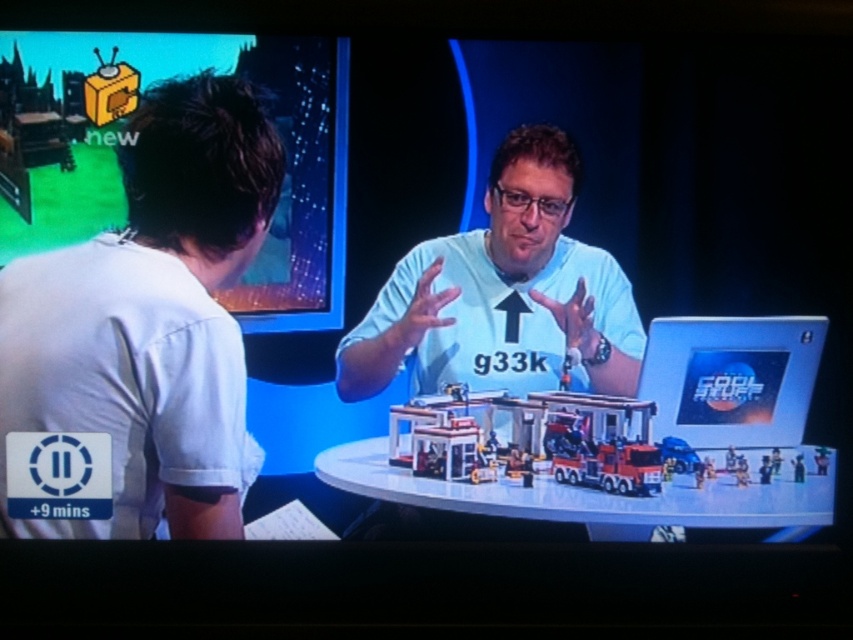
Between point (218, 221) and point (761, 397), which one is positioned behind?

Positioned behind is point (761, 397).

Does white cotton shirt at left appear on the right side of silver metallic laptop at right?

No, white cotton shirt at left is not to the right of silver metallic laptop at right.

You are a GUI agent. You are given a task and a screenshot of the screen. Output one action in this format:
    pyautogui.click(x=<x>, y=<y>)
    Task: Click on the white cotton shirt at left
    The width and height of the screenshot is (853, 640).
    Given the screenshot: What is the action you would take?
    pyautogui.click(x=142, y=337)

Does point (109, 214) lie behind point (795, 468)?

No.

Does matte plastic tv at upper left come in front of plastic toy car at center?

Yes.

The image size is (853, 640). What do you see at coordinates (129, 140) in the screenshot?
I see `matte plastic tv at upper left` at bounding box center [129, 140].

Locate an element on the screen. The image size is (853, 640). matte plastic tv at upper left is located at coordinates (129, 140).

Who is positioned more to the right, light blue t-shirt at center or plastic toy car at center?

plastic toy car at center is more to the right.

Does light blue t-shirt at center have a greater width compared to plastic toy car at center?

Yes.

At what (x,y) coordinates should I click in order to perform the action: click on light blue t-shirt at center. Please return your answer as a coordinate pair (x, y). Looking at the image, I should click on (503, 292).

This screenshot has height=640, width=853. I want to click on light blue t-shirt at center, so click(503, 292).